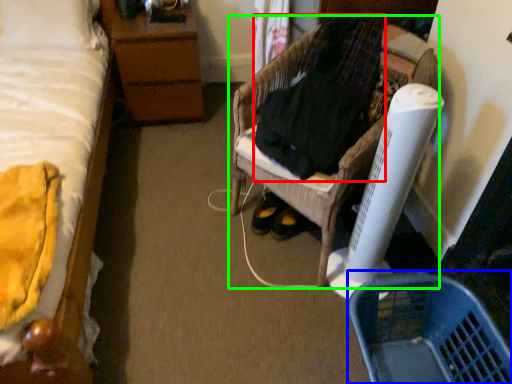
Question: Which object is positioned farthest from clothing (highlighted by a red box)? Select from basket (highlighted by a blue box) and furniture (highlighted by a green box).

Choices:
 (A) basket
 (B) furniture

Answer: (A)